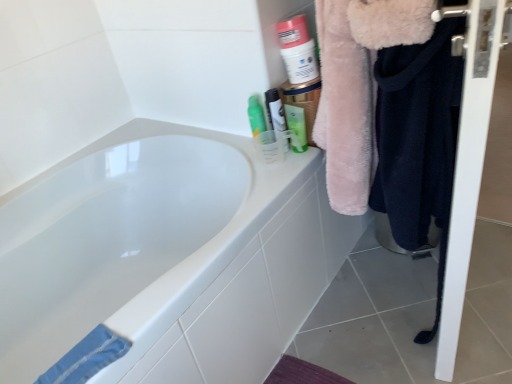
Find the location of a particular element. This screenshot has height=384, width=512. vacant area that lies in front of translucent plastic cup at upper right, arranged as the 1th mouthwash when viewed from the left is located at coordinates (281, 165).